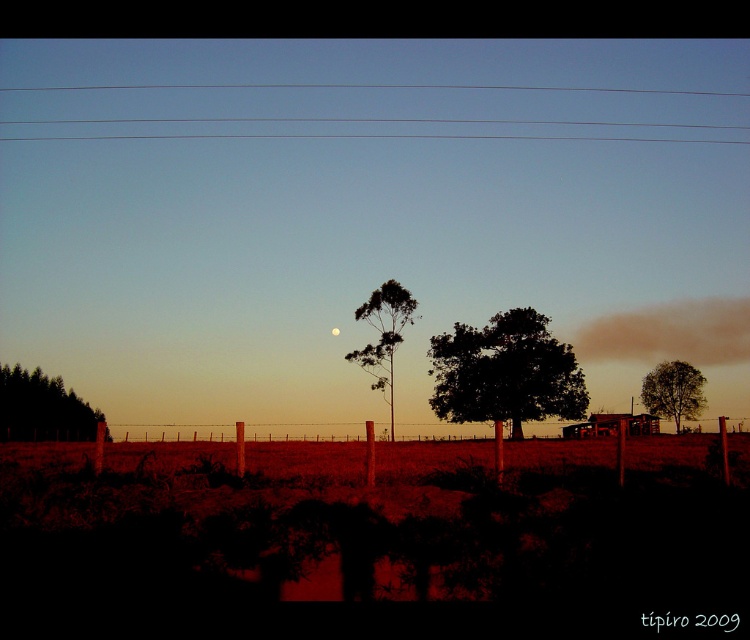
Question: Which point is closer to the camera taking this photo?

Choices:
 (A) (330, 330)
 (B) (4, 371)
 (C) (384, 282)

Answer: (C)

Question: Among these points, which one is nearest to the camera?

Choices:
 (A) (678, 93)
 (B) (408, 296)
 (C) (30, 426)

Answer: (C)

Question: Is green leafy tree at center thinner than green leafy tree at right?

Choices:
 (A) no
 (B) yes

Answer: (A)

Question: Does green matte trees at left lie behind satin silver moon at center?

Choices:
 (A) no
 (B) yes

Answer: (A)

Question: Which object is closer to the camera taking this photo?

Choices:
 (A) green matte trees at left
 (B) clear wire at upper center

Answer: (A)

Question: Can you confirm if dark green leafy tree at center is smaller than green leafy tree at center?

Choices:
 (A) yes
 (B) no

Answer: (B)